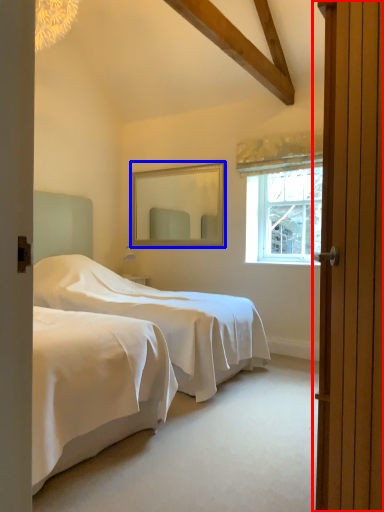
Question: Among these objects, which one is farthest to the camera, door (highlighted by a red box) or mirror (highlighted by a blue box)?

Choices:
 (A) door
 (B) mirror

Answer: (B)